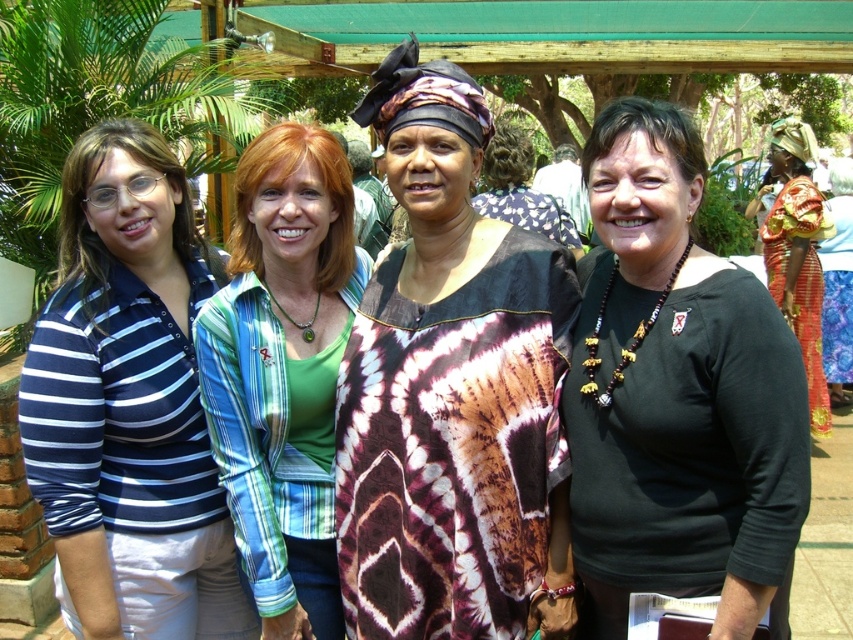
Question: Can you confirm if black matte shirt at center is positioned to the left of green plaid shirt at center?

Choices:
 (A) yes
 (B) no

Answer: (B)

Question: Among these objects, which one is farthest from the camera?

Choices:
 (A) printed fabric dress at center
 (B) green plaid shirt at center
 (C) patterned fabric dress at center
 (D) black matte shirt at center

Answer: (C)

Question: Which point is closer to the camera?

Choices:
 (A) (225, 433)
 (B) (561, 241)
 (C) (740, 554)
 (D) (457, 595)

Answer: (C)

Question: Is shiny red fabric at right wider than patterned fabric dress at center?

Choices:
 (A) no
 (B) yes

Answer: (A)

Question: Based on their relative distances, which object is farther from the blue striped polo shirt at left?

Choices:
 (A) patterned fabric dress at center
 (B) green plaid shirt at center
 (C) shiny red fabric at right

Answer: (C)

Question: Is black matte shirt at center further to camera compared to shiny red fabric at right?

Choices:
 (A) yes
 (B) no

Answer: (B)